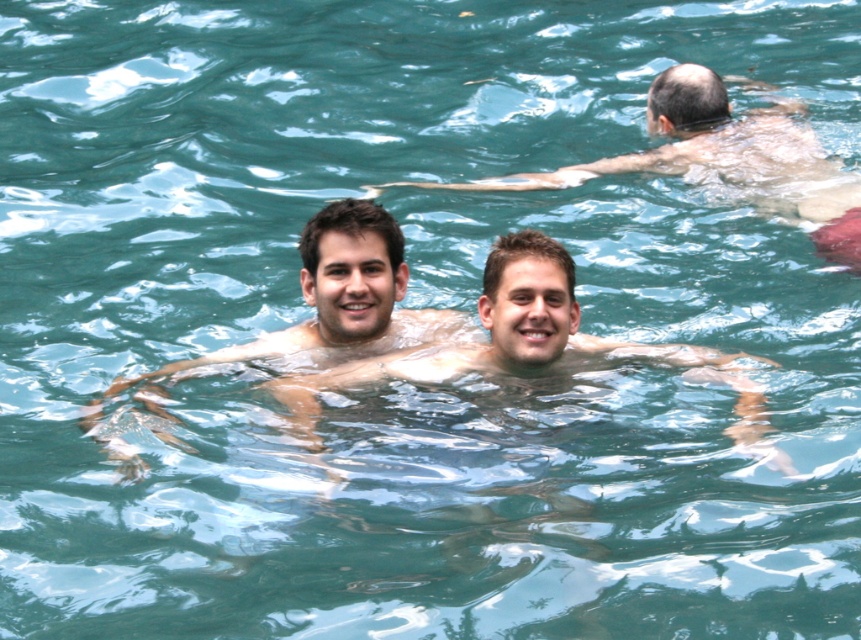
You are a photographer taking a picture of the two people in the water. You want to ensure that both the smooth skin man at center and the smooth skin at center are clearly visible in the photo. Given their positions, which one is closer to the camera?

The smooth skin man at center is closer to the camera because the smooth skin at center is positioned behind him.

You are a photographer taking a picture of two people in the water. You notice the smooth skin at center and the smooth skin man at upper center. Which of the two subjects is positioned lower in the frame?

The smooth skin at center is positioned lower in the frame than the smooth skin man at upper center.